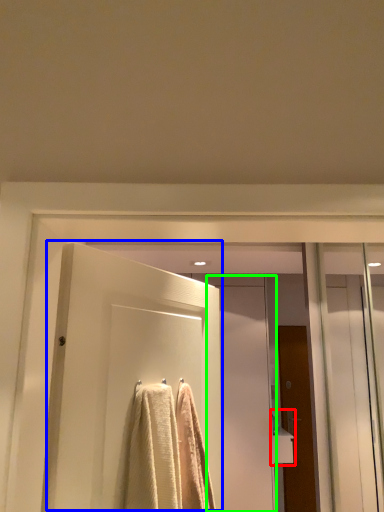
Question: Which object is the farthest from sink (highlighted by a red box)? Choose among these: door (highlighted by a blue box) or screen door (highlighted by a green box).

Choices:
 (A) door
 (B) screen door

Answer: (A)